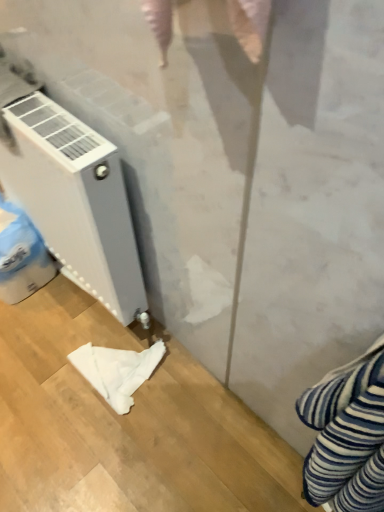
Question: Is white soft cloth at lower left surrounded by white matte radiator at left?

Choices:
 (A) no
 (B) yes

Answer: (A)

Question: Does white matte radiator at left come in front of white soft cloth at lower left?

Choices:
 (A) no
 (B) yes

Answer: (B)

Question: Is white matte radiator at left oriented away from white soft cloth at lower left?

Choices:
 (A) yes
 (B) no

Answer: (B)

Question: Is the depth of white matte radiator at left greater than that of white soft cloth at lower left?

Choices:
 (A) yes
 (B) no

Answer: (B)

Question: Are white matte radiator at left and white soft cloth at lower left beside each other?

Choices:
 (A) no
 (B) yes

Answer: (A)

Question: Considering the relative sizes of white matte radiator at left and white soft cloth at lower left in the image provided, is white matte radiator at left taller than white soft cloth at lower left?

Choices:
 (A) yes
 (B) no

Answer: (A)

Question: Considering the relative sizes of white soft cloth at lower left and white matte radiator at left in the image provided, is white soft cloth at lower left taller than white matte radiator at left?

Choices:
 (A) no
 (B) yes

Answer: (A)

Question: From a real-world perspective, is white soft cloth at lower left located beneath white matte radiator at left?

Choices:
 (A) no
 (B) yes

Answer: (B)

Question: Can you confirm if white soft cloth at lower left is positioned to the right of white matte radiator at left?

Choices:
 (A) yes
 (B) no

Answer: (A)

Question: Is white soft cloth at lower left bigger than white matte radiator at left?

Choices:
 (A) no
 (B) yes

Answer: (A)

Question: Can you confirm if white soft cloth at lower left is positioned to the left of white matte radiator at left?

Choices:
 (A) no
 (B) yes

Answer: (A)

Question: Considering the relative sizes of white soft cloth at lower left and white matte radiator at left in the image provided, is white soft cloth at lower left shorter than white matte radiator at left?

Choices:
 (A) yes
 (B) no

Answer: (A)

Question: Which is correct: white matte radiator at left is inside white soft cloth at lower left, or outside of it?

Choices:
 (A) inside
 (B) outside

Answer: (B)